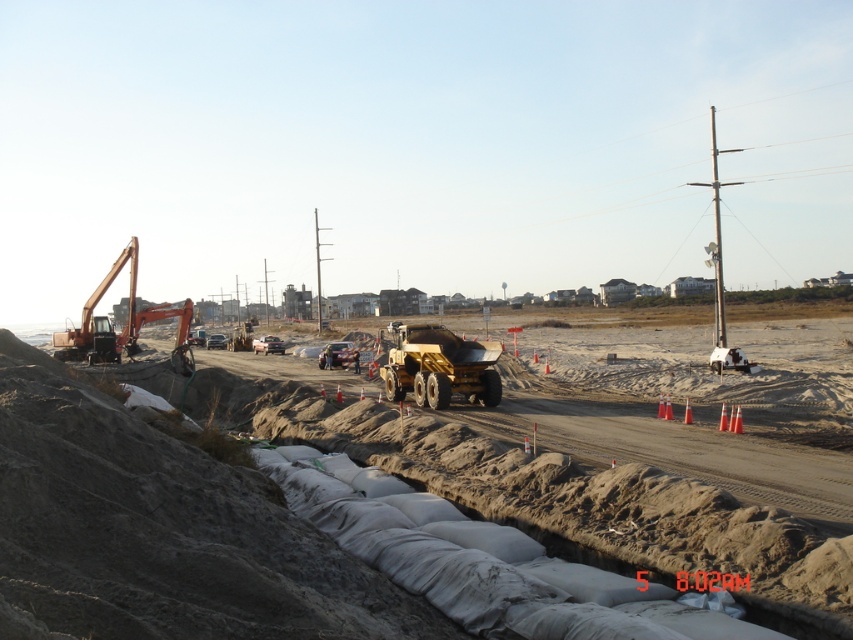
Does yellow metallic dump truck at center appear on the right side of orange metallic excavator at left?

Yes, yellow metallic dump truck at center is to the right of orange metallic excavator at left.

Locate an element on the screen. Image resolution: width=853 pixels, height=640 pixels. yellow metallic dump truck at center is located at coordinates (439, 365).

Based on the photo, does matte yellow truck at center appear on the right side of yellow metallic dump truck at center?

No, matte yellow truck at center is not to the right of yellow metallic dump truck at center.

Does matte yellow truck at center appear over yellow metallic dump truck at center?

No, matte yellow truck at center is not above yellow metallic dump truck at center.

Between point (799, 586) and point (480, 353), which one is positioned behind?

The point (480, 353) is behind.

Find the location of `matte yellow truck at center`. matte yellow truck at center is located at coordinates (161, 531).

Does matte yellow truck at center appear on the left side of orange metallic excavator at left?

No, matte yellow truck at center is not to the left of orange metallic excavator at left.

Who is more forward, (213, 588) or (134, 310)?

Point (213, 588)

The width and height of the screenshot is (853, 640). Find the location of `matte yellow truck at center`. matte yellow truck at center is located at coordinates (161, 531).